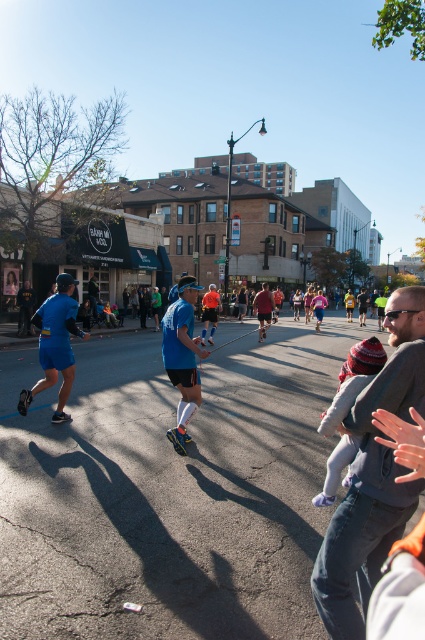
Question: Which object is positioned closest to the orange reflective vest at center?

Choices:
 (A) blue fabric shorts at left
 (B) matte brown shirt at center
 (C) gray fleece jacket at center
 (D) blue fabric running outfit at center

Answer: (B)

Question: Which point is closer to the camera taking this photo?

Choices:
 (A) (263, 284)
 (B) (203, 342)
 (C) (402, 396)
 (D) (178, 342)

Answer: (C)

Question: Does gray fleece jacket at center come in front of blue fabric running outfit at center?

Choices:
 (A) no
 (B) yes

Answer: (B)

Question: Among these points, which one is farthest from the camera?

Choices:
 (A) (192, 348)
 (B) (215, 324)
 (C) (263, 330)

Answer: (C)

Question: Is blue fabric shorts at left positioned at the back of matte brown shirt at center?

Choices:
 (A) no
 (B) yes

Answer: (A)

Question: Is blue fabric running outfit at center thinner than orange reflective vest at center?

Choices:
 (A) no
 (B) yes

Answer: (B)